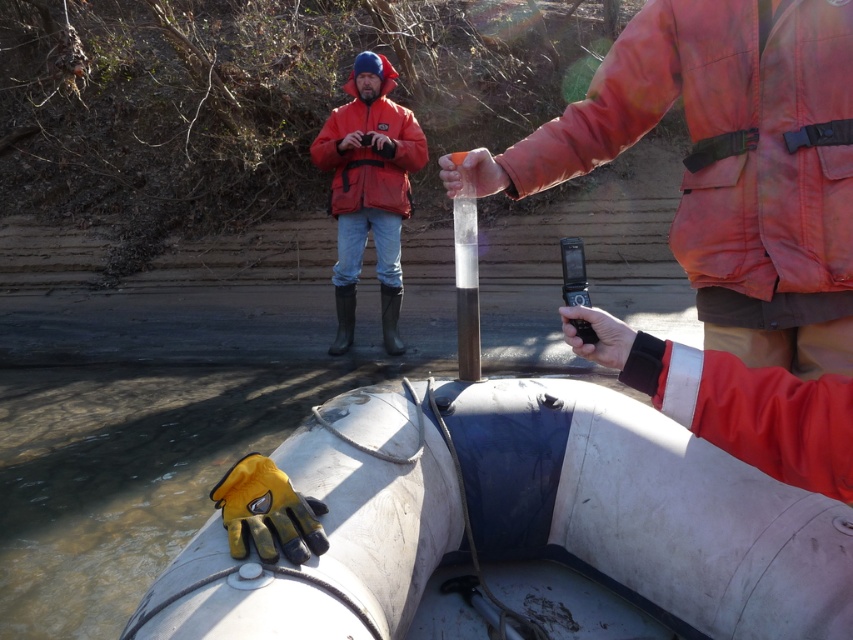
You are standing at the edge of the water and want to reach the matte orange jacket at center without stepping into the water. The white rubber boat at lower center is in your path. Can you walk around the boat to reach the jacket?

The white rubber boat at lower center is closer to the viewer than matte orange jacket at center, so you can walk around the boat to reach the matte orange jacket at center.

You are a researcher looking at the image of the fieldwork scene. You need to locate the orange matte jacket at upper right and the matte orange jacket at center. According to the spatial arrangement, which jacket is positioned lower in the image?

The orange matte jacket at upper right is positioned below the matte orange jacket at center, so it is lower in the image.

You are a field researcher who needs to access the white rubber boat at lower center. The matte orange jacket at center is blocking your path. Can you move the jacket to reach the boat?

The white rubber boat at lower center is positioned under the matte orange jacket at center, so the jacket is blocking the boat. You would need to move the jacket to access the boat.